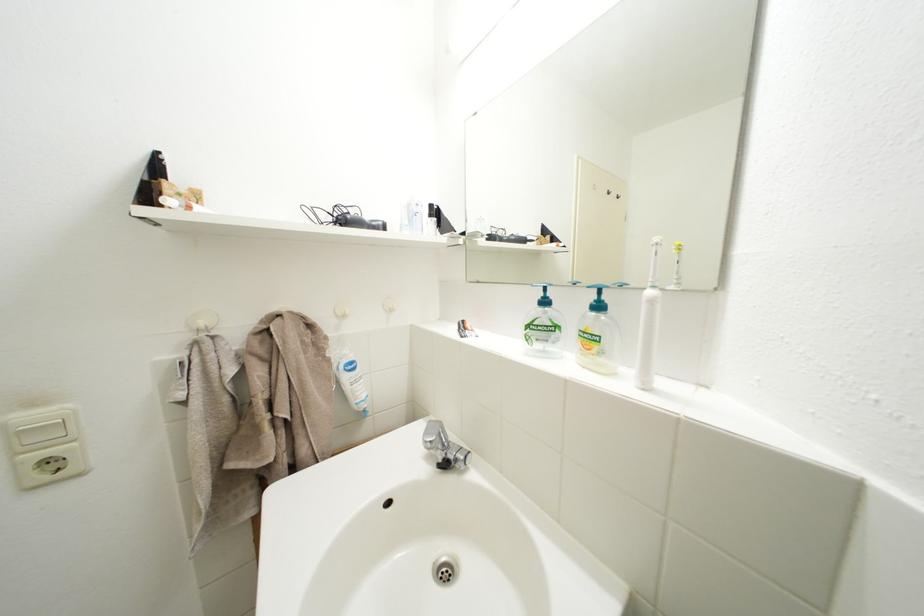
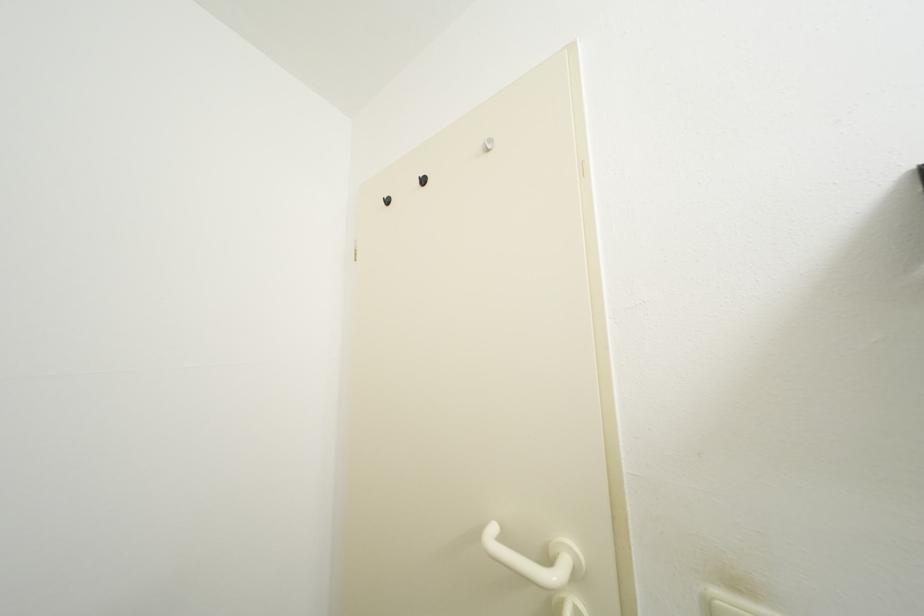
Question: Based on the continuous images, in which direction is the camera rotating? Reply with the corresponding letter.

Choices:
 (A) Left
 (B) Right
 (C) Up
 (D) Down

Answer: (A)